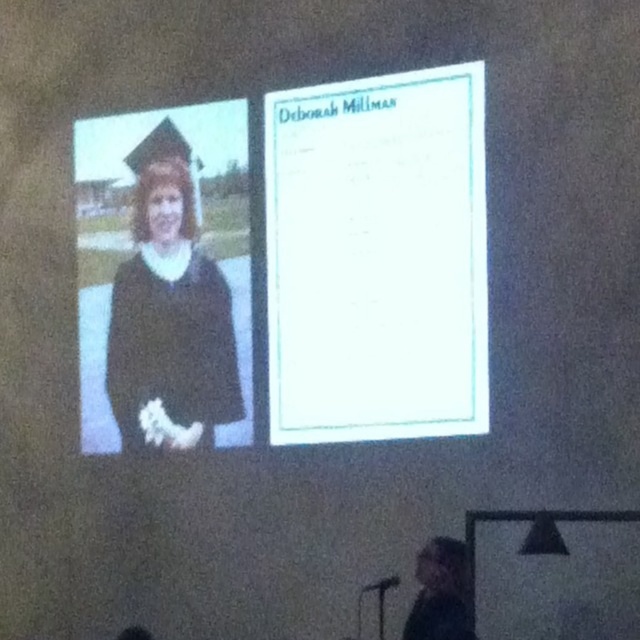
Question: Which point is closer to the camera?

Choices:
 (A) (308, 416)
 (B) (147, 164)

Answer: (A)

Question: Can you confirm if white paper at upper center is wider than matte black gown at left?

Choices:
 (A) yes
 (B) no

Answer: (A)

Question: Where is white paper at upper center located in relation to matte black gown at left in the image?

Choices:
 (A) right
 (B) left

Answer: (A)

Question: Is white paper at upper center to the left of matte black gown at left from the viewer's perspective?

Choices:
 (A) no
 (B) yes

Answer: (A)